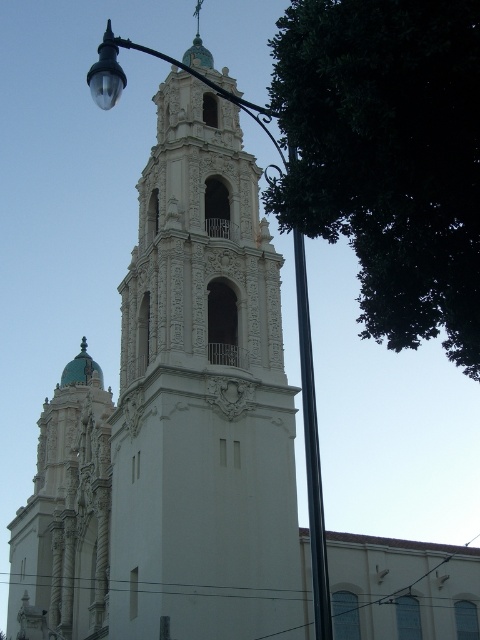
Question: Can you confirm if white stone tower at center is positioned to the right of black metal pole at center?

Choices:
 (A) yes
 (B) no

Answer: (B)

Question: Which object is positioned farthest from the white stone tower at center?

Choices:
 (A) green leafy tree at upper right
 (B) black metal pole at center

Answer: (A)

Question: Can you confirm if white stone tower at center is positioned to the right of green leafy tree at upper right?

Choices:
 (A) no
 (B) yes

Answer: (A)

Question: Does green leafy tree at upper right lie behind black metal pole at center?

Choices:
 (A) no
 (B) yes

Answer: (A)

Question: Which is farther from the green leafy tree at upper right?

Choices:
 (A) white stone tower at center
 (B) black metal pole at center

Answer: (A)

Question: Estimate the real-world distances between objects in this image. Which object is closer to the black metal pole at center?

Choices:
 (A) white stone tower at center
 (B) green leafy tree at upper right

Answer: (B)